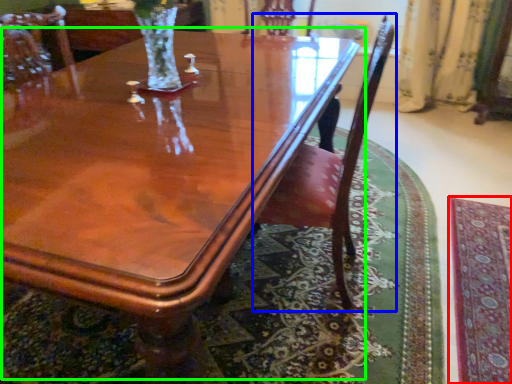
Question: Which object is the closest to the mat (highlighted by a red box)? Choose among these: chair (highlighted by a blue box) or coffee table (highlighted by a green box).

Choices:
 (A) chair
 (B) coffee table

Answer: (A)